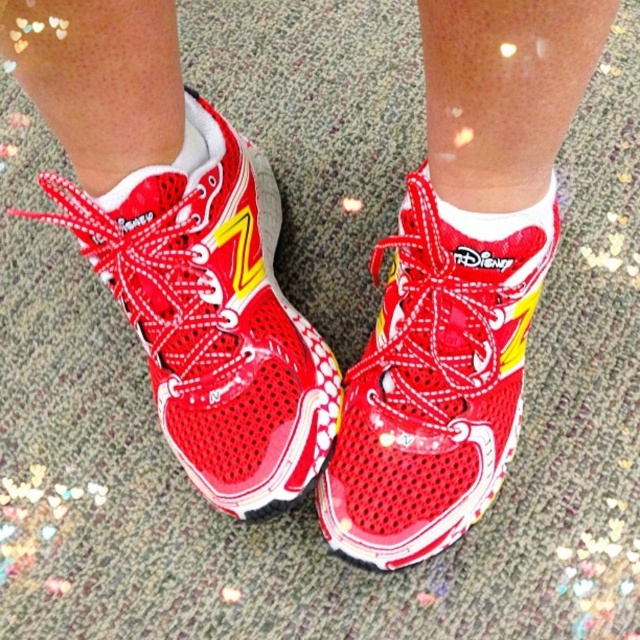
You are trying to put on a pair of shiny red running shoe at center and a white soft sock at center. Which item should you put on first according to their sizes?

The white soft sock at center should be put on first because the shiny red running shoe at center might be wider than the white soft sock at center, so you need to wear the sock before the shoe.

You are designing a virtual fitting room and need to place a 3D model of the shiny red running shoe at center on a digital floor. The coordinate system starts at the bottom left corner of the image. What are the coordinates where the shoe should be placed?

The shiny red running shoe at center should be placed at coordinates approximately 0.495 on the x axis and 0.334 on the y axis, as specified in the description.